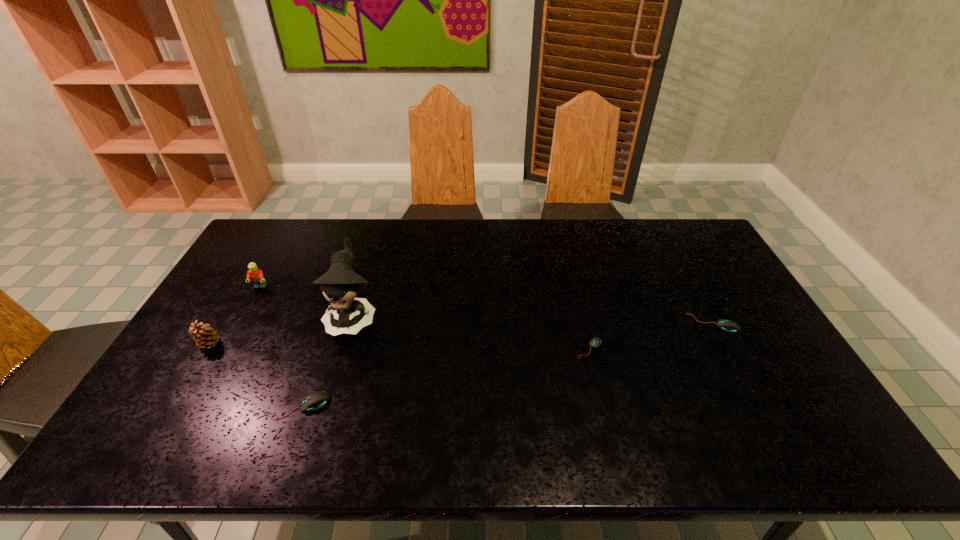
Where is `vacant area located on the right of the second nearest mouse`? The width and height of the screenshot is (960, 540). vacant area located on the right of the second nearest mouse is located at coordinates (732, 348).

Locate an element on the screen. The width and height of the screenshot is (960, 540). vacant space located on the back of the fifth tallest object is located at coordinates (691, 283).

Find the location of a particular element. free space located on the face of the farthest object is located at coordinates (251, 303).

This screenshot has height=540, width=960. Find the location of `vacant point located 0.100m on the front of the pinecone`. vacant point located 0.100m on the front of the pinecone is located at coordinates (186, 382).

I want to click on free region located at the face of the doll, so click(x=341, y=359).

Find the location of a particular element. Image resolution: width=960 pixels, height=540 pixels. object located at the near edge is located at coordinates (316, 400).

The image size is (960, 540). I want to click on Lego that is at the left edge, so click(x=256, y=275).

Locate an element on the screen. This screenshot has height=540, width=960. pinecone at the left edge is located at coordinates (205, 337).

The height and width of the screenshot is (540, 960). Find the location of `object positioned at the right edge`. object positioned at the right edge is located at coordinates (727, 325).

In order to click on free space at the far edge in this screenshot , I will do `click(353, 251)`.